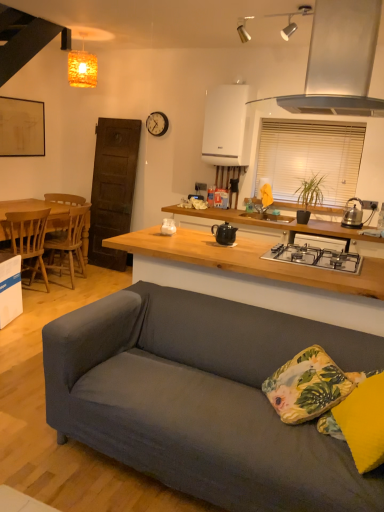
Where is `free space in front of black ceramic teapot at center`? Image resolution: width=384 pixels, height=512 pixels. free space in front of black ceramic teapot at center is located at coordinates (242, 248).